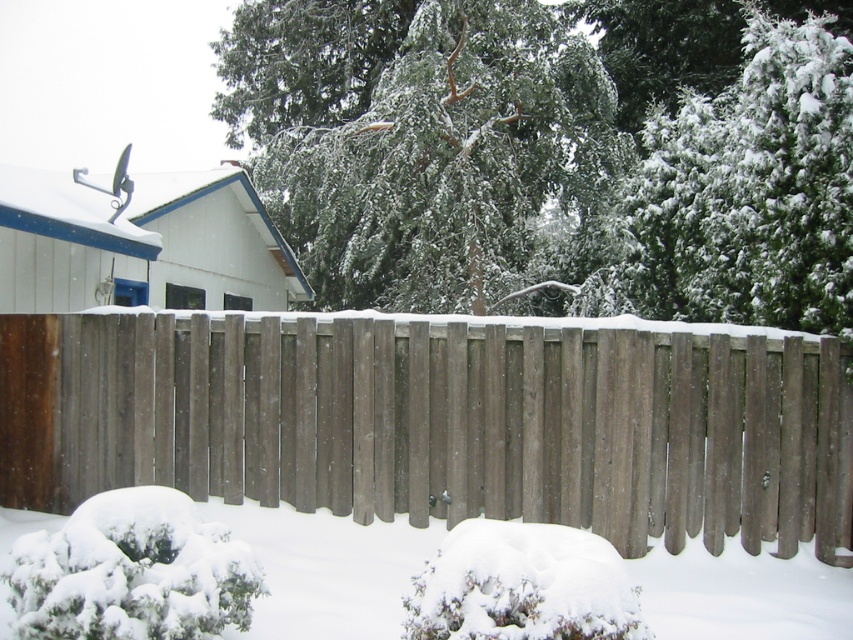
Does brown wood fence at center appear on the right side of green textured tree at upper center?

In fact, brown wood fence at center is to the left of green textured tree at upper center.

Can you confirm if brown wood fence at center is positioned above green textured tree at upper center?

Incorrect, brown wood fence at center is not positioned above green textured tree at upper center.

What are the coordinates of `brown wood fence at center` in the screenshot? It's located at (436, 422).

Locate an element on the screen. brown wood fence at center is located at coordinates (436, 422).

Between green textured tree at upper center and white fluffy snow at center, which one has less height?

white fluffy snow at center is shorter.

Is green textured tree at upper center further to the viewer compared to white fluffy snow at center?

Yes, it is.

Identify the location of green textured tree at upper center. (416, 138).

Which of these two, brown wood fence at center or white fluffy snow at center, stands taller?

With more height is brown wood fence at center.

Between brown wood fence at center and white fluffy snow at center, which one is positioned lower?

white fluffy snow at center

Between point (335, 467) and point (698, 579), which one is positioned behind?

The point (335, 467) is more distant.

Find the location of `brown wood fence at center`. brown wood fence at center is located at coordinates (436, 422).